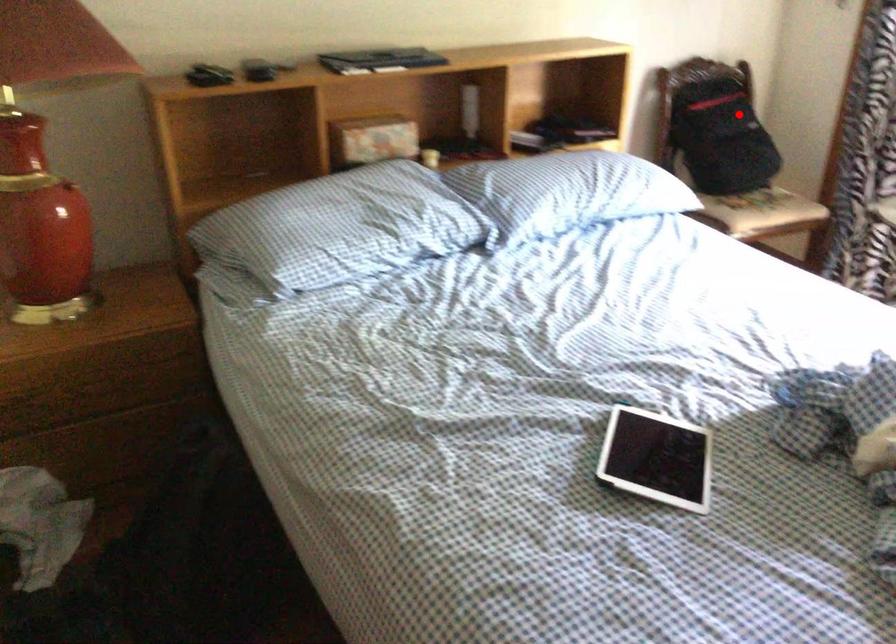
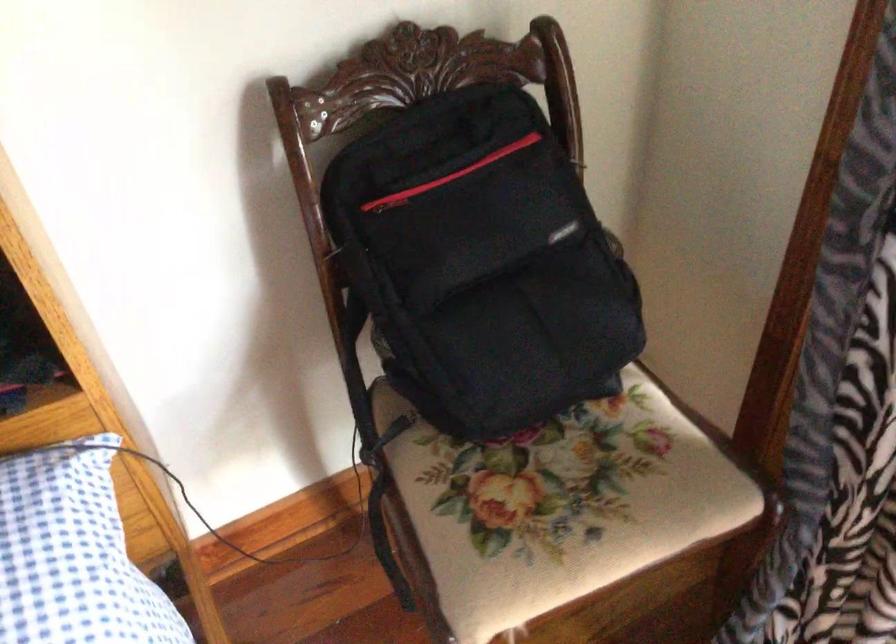
Find the pixel in the second image that matches the highlighted location in the first image.

(480, 263)